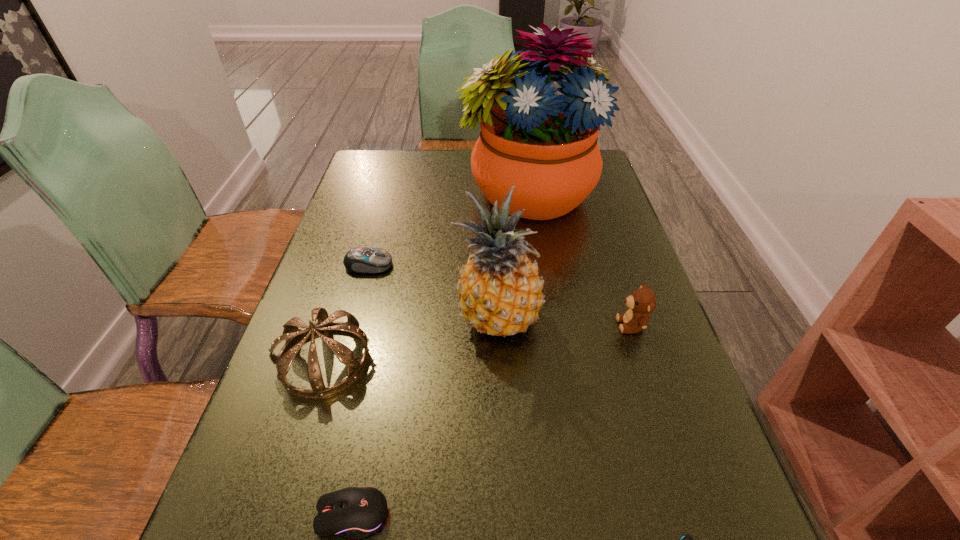
At what (x,y) coordinates should I click in order to perform the action: click on free space located 0.400m on the face of the fourth tallest object. Please return your answer as a coordinate pair (x, y). The width and height of the screenshot is (960, 540). Looking at the image, I should click on (430, 325).

Locate an element on the screen. The image size is (960, 540). free space located 0.100m on the face of the fourth tallest object is located at coordinates (570, 325).

What are the coordinates of `free spot located on the wheel side of the farthest mouse` in the screenshot? It's located at (429, 265).

Locate an element on the screen. The image size is (960, 540). object that is at the far edge is located at coordinates (545, 144).

Image resolution: width=960 pixels, height=540 pixels. In order to click on tiara present at the left edge in this screenshot , I will do coord(292,334).

Where is `computer mouse located in the left edge section of the desktop`? computer mouse located in the left edge section of the desktop is located at coordinates (366, 260).

At what (x,y) coordinates should I click in order to perform the action: click on flower arrangement at the right edge. Please return your answer as a coordinate pair (x, y). This screenshot has width=960, height=540. Looking at the image, I should click on (545, 144).

This screenshot has height=540, width=960. Identify the location of teddy bear that is at the right edge. (642, 302).

This screenshot has width=960, height=540. In order to click on object that is at the far right corner in this screenshot , I will do `click(545, 144)`.

The width and height of the screenshot is (960, 540). I want to click on vacant area at the far edge, so (x=443, y=183).